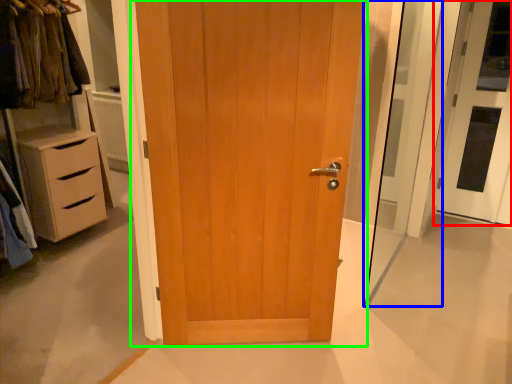
Question: Estimate the real-world distances between objects in this image. Which object is closer to door (highlighted by a red box), screen door (highlighted by a blue box) or door (highlighted by a green box)?

Choices:
 (A) screen door
 (B) door

Answer: (A)